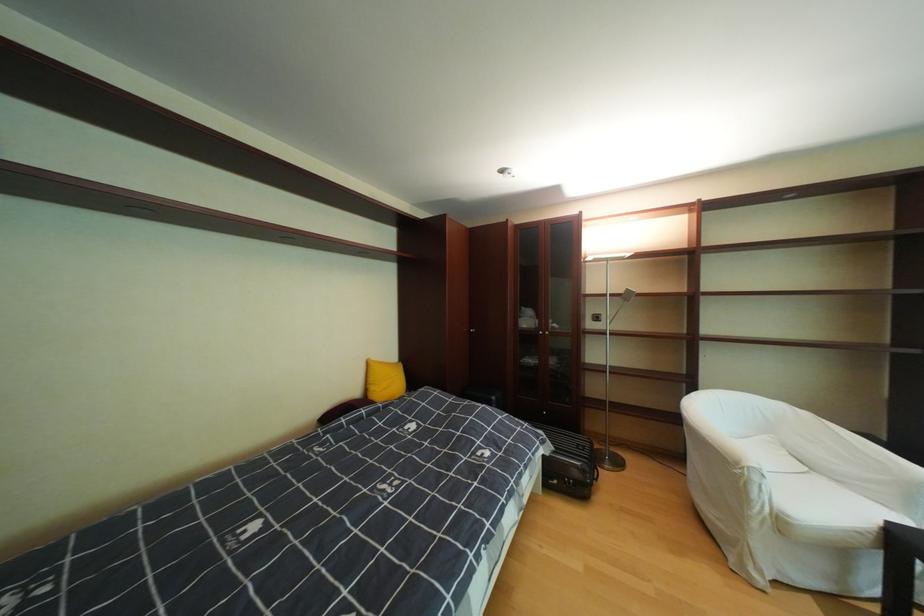
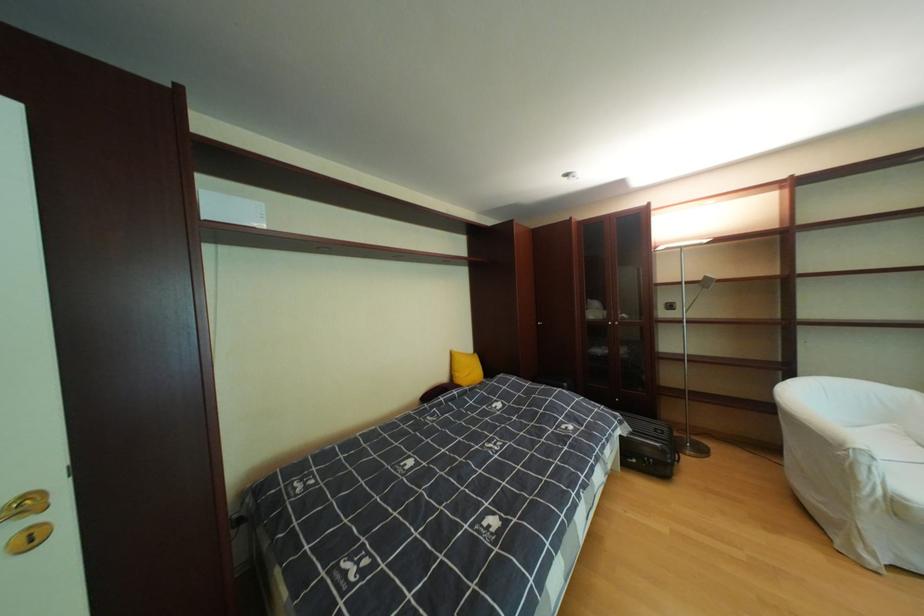
Question: The camera is either moving clockwise (left) or counter-clockwise (right) around the object. The first image is from the beginning of the video and the second image is from the end. Is the camera moving left or right when shooting the video?

Choices:
 (A) Left
 (B) Right

Answer: (B)